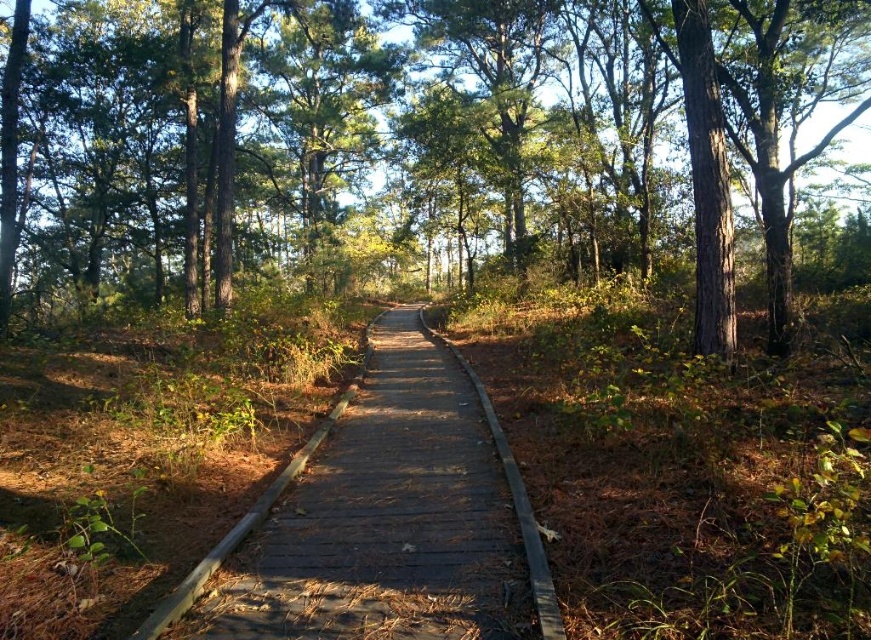
Question: Is green matte tree at center above wooden boardwalk at center?

Choices:
 (A) no
 (B) yes

Answer: (B)

Question: Which point appears closest to the camera in this image?

Choices:
 (A) (562, 32)
 (B) (255, 524)

Answer: (B)

Question: Can you confirm if green matte tree at center is positioned to the left of wooden boardwalk at center?

Choices:
 (A) no
 (B) yes

Answer: (B)

Question: Does green matte tree at center appear under wooden boardwalk at center?

Choices:
 (A) no
 (B) yes

Answer: (A)